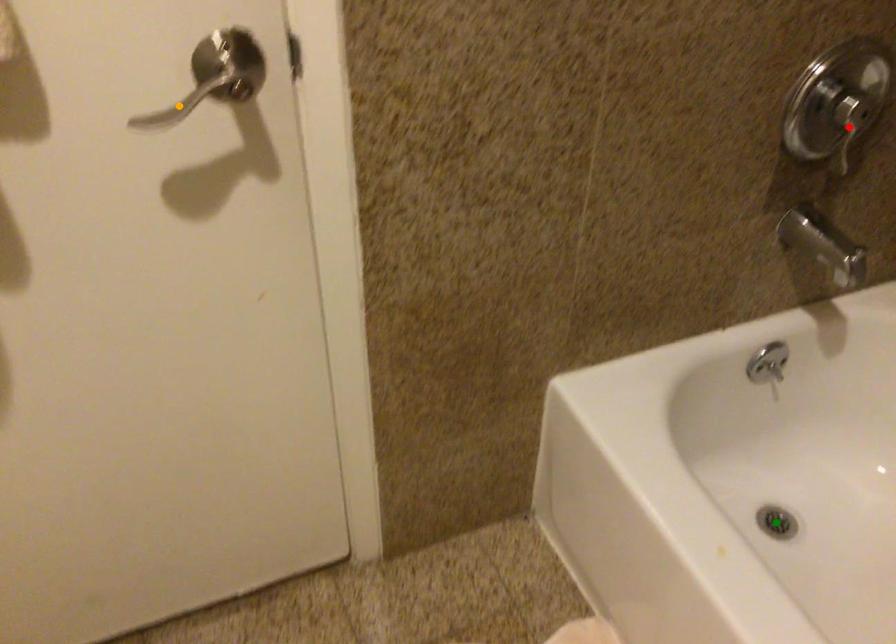
Order these from nearest to farthest:
- red point
- green point
- orange point

orange point
red point
green point